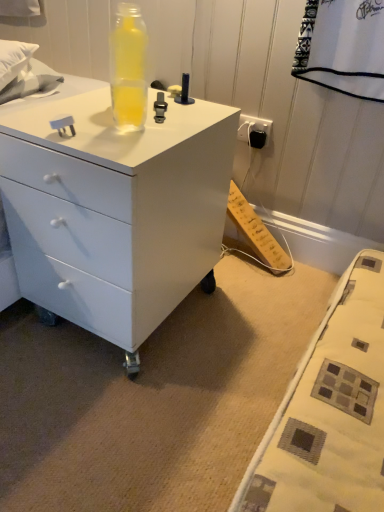
Measure the distance between white glossy chest of drawers at center and camera.

white glossy chest of drawers at center is 30.11 inches from camera.

Image resolution: width=384 pixels, height=512 pixels. Describe the element at coordinates (115, 210) in the screenshot. I see `white glossy chest of drawers at center` at that location.

The width and height of the screenshot is (384, 512). In order to click on white glossy chest of drawers at center in this screenshot , I will do `click(115, 210)`.

Describe the element at coordinates (128, 68) in the screenshot. I see `transparent plastic bottle at upper center` at that location.

What is the approximate width of transparent plastic bottle at upper center?

It is 10.27 centimeters.

At what (x,y) coordinates should I click in order to perform the action: click on transparent plastic bottle at upper center. Please return your answer as a coordinate pair (x, y). The height and width of the screenshot is (512, 384). Looking at the image, I should click on (128, 68).

Find the location of a particular element. This screenshot has height=512, width=384. white glossy chest of drawers at center is located at coordinates (115, 210).

Considering the positions of objects transparent plastic bottle at upper center and white glossy chest of drawers at center in the image provided, who is more to the left, transparent plastic bottle at upper center or white glossy chest of drawers at center?

Result: white glossy chest of drawers at center is more to the left.

Considering the relative positions of transparent plastic bottle at upper center and white glossy chest of drawers at center in the image provided, is transparent plastic bottle at upper center in front of white glossy chest of drawers at center?

No, the depth of transparent plastic bottle at upper center is greater than that of white glossy chest of drawers at center.

Which point is more distant from viewer, (121, 72) or (27, 188)?

The point (27, 188) is farther from the camera.

From the image's perspective, which is below, transparent plastic bottle at upper center or white glossy chest of drawers at center?

From the image's view, white glossy chest of drawers at center is below.

From a real-world perspective, is transparent plastic bottle at upper center positioned under white glossy chest of drawers at center based on gravity?

Actually, transparent plastic bottle at upper center is physically above white glossy chest of drawers at center in the real world.

Can you confirm if transparent plastic bottle at upper center is thinner than white glossy chest of drawers at center?

Indeed, transparent plastic bottle at upper center has a lesser width compared to white glossy chest of drawers at center.

Based on the photo, in terms of height, does transparent plastic bottle at upper center look taller or shorter compared to white glossy chest of drawers at center?

Clearly, transparent plastic bottle at upper center is shorter compared to white glossy chest of drawers at center.

Which of these two, transparent plastic bottle at upper center or white glossy chest of drawers at center, is bigger?

white glossy chest of drawers at center is bigger.

Based on the photo, is white glossy chest of drawers at center located within transparent plastic bottle at upper center?

No, white glossy chest of drawers at center is not inside transparent plastic bottle at upper center.

Is transparent plastic bottle at upper center in contact with white glossy chest of drawers at center?

No, transparent plastic bottle at upper center is not touching white glossy chest of drawers at center.

Looking at this image, is transparent plastic bottle at upper center facing away from white glossy chest of drawers at center?

No, transparent plastic bottle at upper center is not facing the opposite direction of white glossy chest of drawers at center.

Where is `the chest of drawers that is below the transparent plastic bottle at upper center (from the image's perspective)`? the chest of drawers that is below the transparent plastic bottle at upper center (from the image's perspective) is located at coordinates (115, 210).

Considering the positions of objects white glossy chest of drawers at center and transparent plastic bottle at upper center in the image provided, who is more to the right, white glossy chest of drawers at center or transparent plastic bottle at upper center?

From the viewer's perspective, transparent plastic bottle at upper center appears more on the right side.

Is white glossy chest of drawers at center further to the viewer compared to transparent plastic bottle at upper center?

No, white glossy chest of drawers at center is in front of transparent plastic bottle at upper center.

Is point (152, 312) positioned before point (144, 122)?

No, (152, 312) is behind (144, 122).

From the image's perspective, is white glossy chest of drawers at center positioned above or below transparent plastic bottle at upper center?

white glossy chest of drawers at center is situated lower than transparent plastic bottle at upper center in the image.

From a real-world perspective, is white glossy chest of drawers at center positioned above or below transparent plastic bottle at upper center?

Clearly, from a real-world perspective, white glossy chest of drawers at center is below transparent plastic bottle at upper center.

Between white glossy chest of drawers at center and transparent plastic bottle at upper center, which one has larger width?

Wider between the two is white glossy chest of drawers at center.

Who is taller, white glossy chest of drawers at center or transparent plastic bottle at upper center?

Standing taller between the two is white glossy chest of drawers at center.

Can you confirm if white glossy chest of drawers at center is smaller than transparent plastic bottle at upper center?

No.

Is white glossy chest of drawers at center spatially inside transparent plastic bottle at upper center, or outside of it?

white glossy chest of drawers at center is not inside transparent plastic bottle at upper center, it's outside.

Is white glossy chest of drawers at center far away from transparent plastic bottle at upper center?

No.

Could you tell me if white glossy chest of drawers at center is facing transparent plastic bottle at upper center?

No, white glossy chest of drawers at center is not oriented towards transparent plastic bottle at upper center.

Locate an element on the screen. bottle behind the white glossy chest of drawers at center is located at coordinates (128, 68).

This screenshot has width=384, height=512. I want to click on bottle above the white glossy chest of drawers at center (from the image's perspective), so click(x=128, y=68).

At what (x,y) coordinates should I click in order to perform the action: click on bottle above the white glossy chest of drawers at center (from a real-world perspective). Please return your answer as a coordinate pair (x, y). The width and height of the screenshot is (384, 512). Looking at the image, I should click on (128, 68).